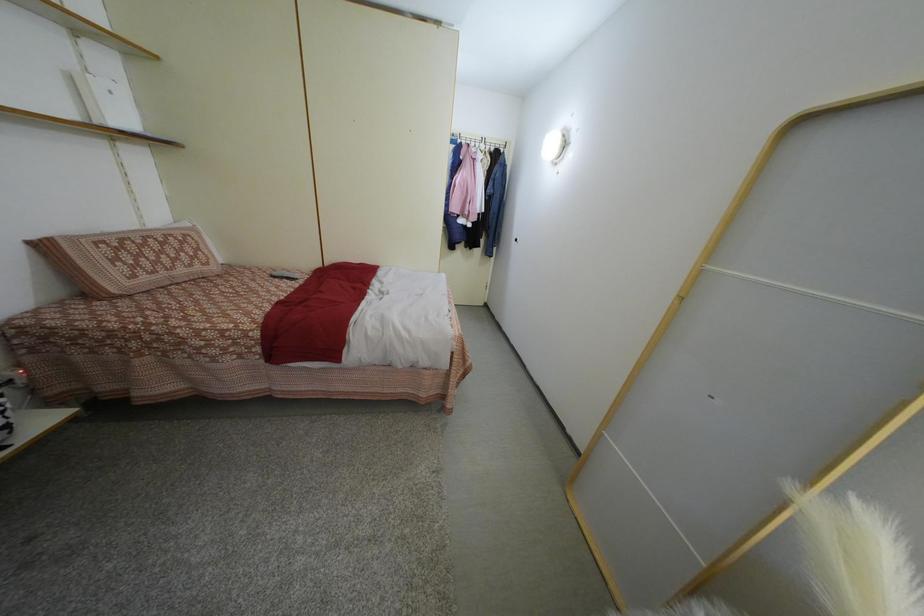
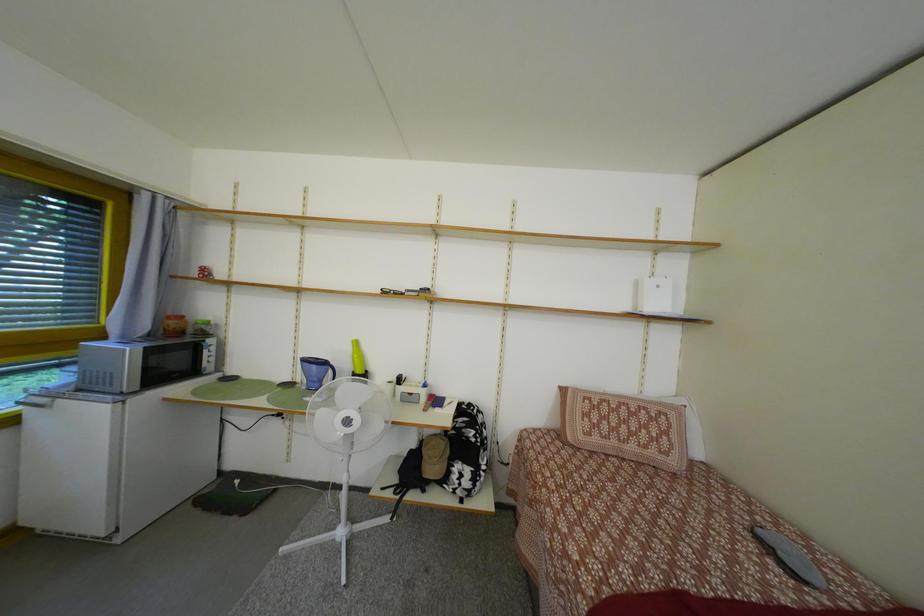
Question: The camera is either moving clockwise (left) or counter-clockwise (right) around the object. The first image is from the beginning of the video and the second image is from the end. Is the camera moving left or right when shooting the video?

Choices:
 (A) Left
 (B) Right

Answer: (B)